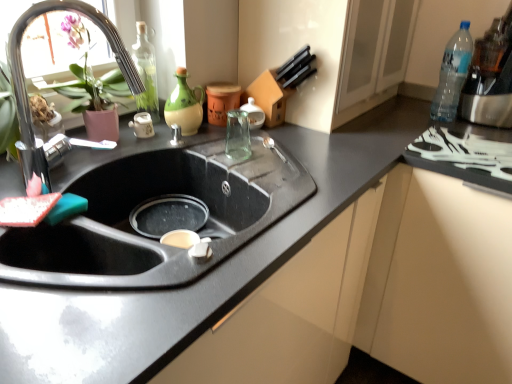
Where is `vacant area that is in front of green matte jug at upper center, placed as the 2th bottle when sorted from right to left`? This screenshot has height=384, width=512. vacant area that is in front of green matte jug at upper center, placed as the 2th bottle when sorted from right to left is located at coordinates (189, 149).